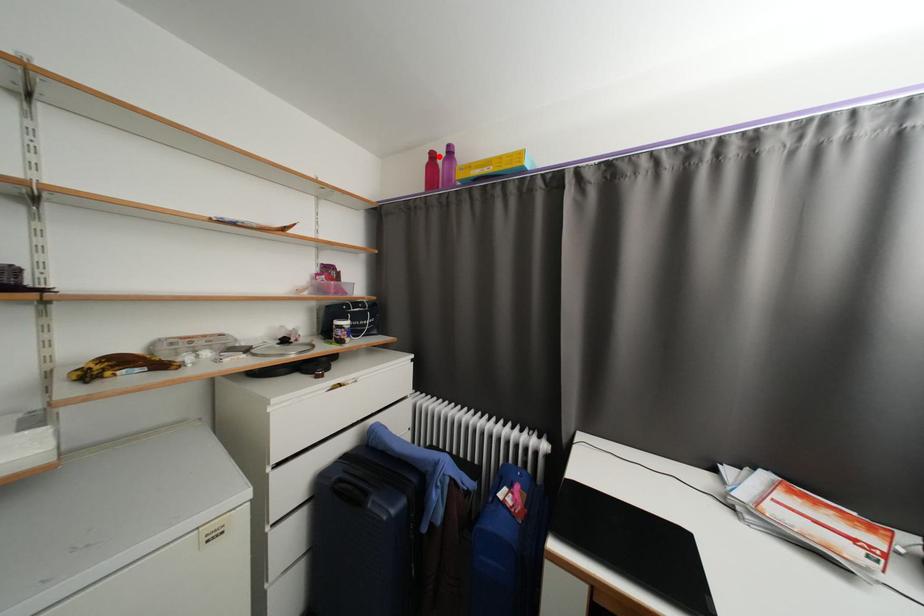
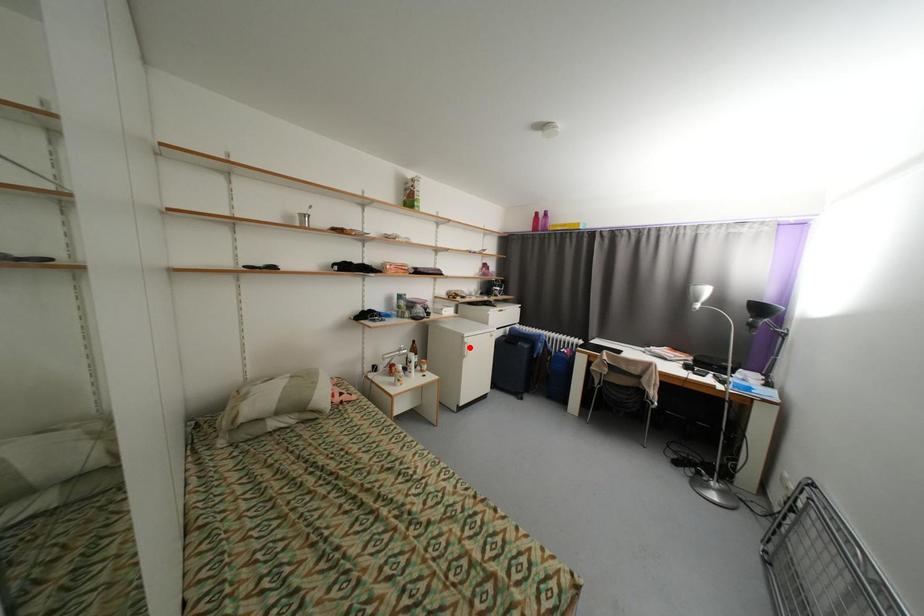
I am providing you with two images of the same scene from different viewpoints. A red point is marked on the first image and another point is marked on the second image. Do the highlighted points in image1 and image2 indicate the same real-world spot?

No